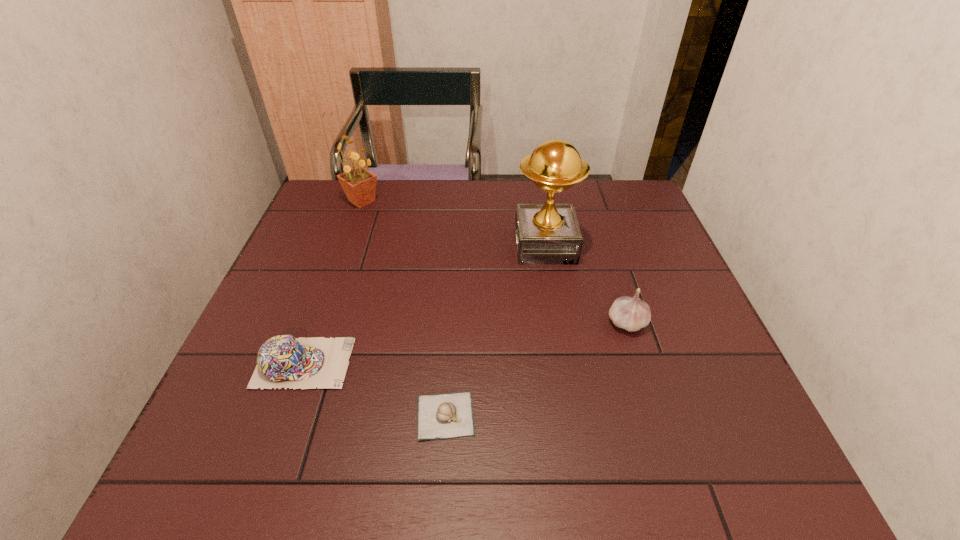
Find the location of a particular element. The height and width of the screenshot is (540, 960). the tallest object is located at coordinates (546, 234).

Locate an element on the screen. the fourth object from left to right is located at coordinates (546, 234).

You are a GUI agent. You are given a task and a screenshot of the screen. Output one action in this format:
    pyautogui.click(x=<x>, y=<y>)
    Task: Click on the farthest object
    
    Given the screenshot: What is the action you would take?
    pyautogui.click(x=359, y=184)

The width and height of the screenshot is (960, 540). I want to click on sunflower, so click(359, 184).

Find the location of a particular element. the third farthest object is located at coordinates (631, 313).

The image size is (960, 540). I want to click on the right garlic, so coord(631,313).

The height and width of the screenshot is (540, 960). I want to click on the second nearest object, so click(x=283, y=361).

Where is `cap`? This screenshot has height=540, width=960. cap is located at coordinates (283, 361).

You are a GUI agent. You are given a task and a screenshot of the screen. Output one action in this format:
    pyautogui.click(x=<x>, y=<y>)
    Task: Click on the left garlic
    The width and height of the screenshot is (960, 540).
    Given the screenshot: What is the action you would take?
    pyautogui.click(x=450, y=415)

Image resolution: width=960 pixels, height=540 pixels. Find the location of `the nearer garlic`. the nearer garlic is located at coordinates (450, 415).